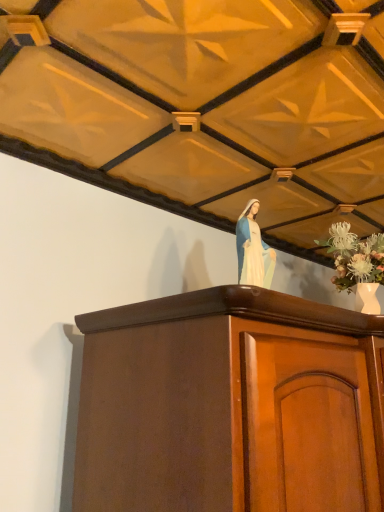
Question: Should I look upward or downward to see mahogany cabinet at center?

Choices:
 (A) up
 (B) down

Answer: (B)

Question: Is white porcelain statue at upper center next to white porcelain vase at upper right and touching it?

Choices:
 (A) no
 (B) yes

Answer: (A)

Question: Would you say white porcelain statue at upper center is a long distance from white porcelain vase at upper right?

Choices:
 (A) no
 (B) yes

Answer: (A)

Question: Is the depth of white porcelain statue at upper center greater than that of white porcelain vase at upper right?

Choices:
 (A) yes
 (B) no

Answer: (B)

Question: From the image's perspective, does white porcelain statue at upper center appear lower than white porcelain vase at upper right?

Choices:
 (A) no
 (B) yes

Answer: (A)

Question: Can you confirm if white porcelain statue at upper center is shorter than white porcelain vase at upper right?

Choices:
 (A) no
 (B) yes

Answer: (B)

Question: Can you confirm if white porcelain statue at upper center is smaller than white porcelain vase at upper right?

Choices:
 (A) no
 (B) yes

Answer: (B)

Question: Can we say mahogany cabinet at center lies outside white porcelain statue at upper center?

Choices:
 (A) no
 (B) yes

Answer: (B)

Question: Could white porcelain statue at upper center be considered to be inside mahogany cabinet at center?

Choices:
 (A) yes
 (B) no

Answer: (B)

Question: From the image's perspective, is mahogany cabinet at center over white porcelain statue at upper center?

Choices:
 (A) yes
 (B) no

Answer: (B)

Question: Can you confirm if mahogany cabinet at center is smaller than white porcelain statue at upper center?

Choices:
 (A) yes
 (B) no

Answer: (B)

Question: Considering the relative sizes of mahogany cabinet at center and white porcelain statue at upper center in the image provided, is mahogany cabinet at center bigger than white porcelain statue at upper center?

Choices:
 (A) yes
 (B) no

Answer: (A)

Question: Is mahogany cabinet at center oriented away from white porcelain statue at upper center?

Choices:
 (A) yes
 (B) no

Answer: (B)

Question: Is white porcelain vase at upper right thinner than mahogany cabinet at center?

Choices:
 (A) no
 (B) yes

Answer: (B)